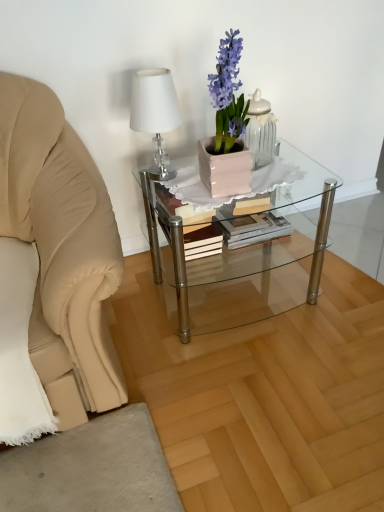
You are a GUI agent. You are given a task and a screenshot of the screen. Output one action in this format:
    pyautogui.click(x=<x>, y=<y>)
    Task: Click on the vacant area in front of clear glass coffee table at center
    
    Given the screenshot: What is the action you would take?
    pyautogui.click(x=247, y=382)